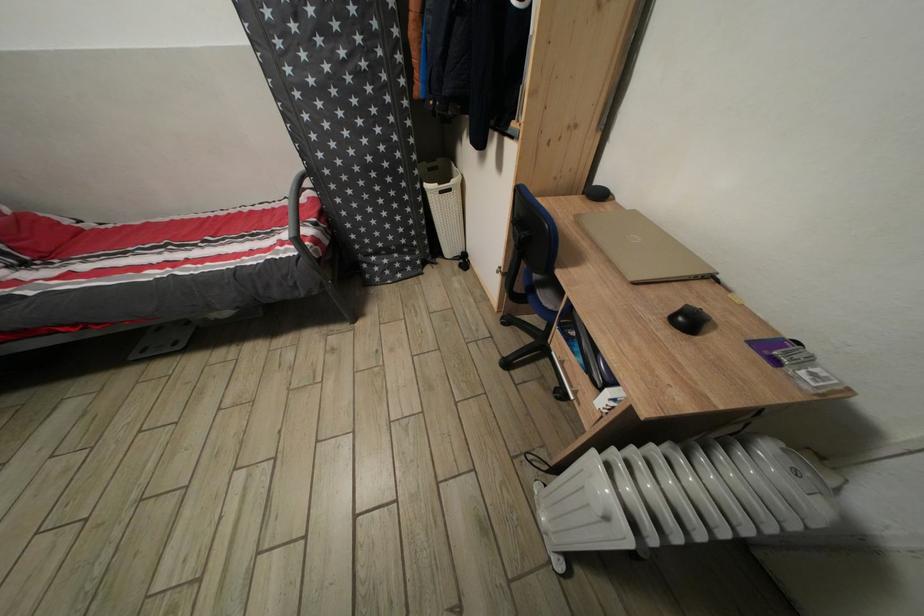
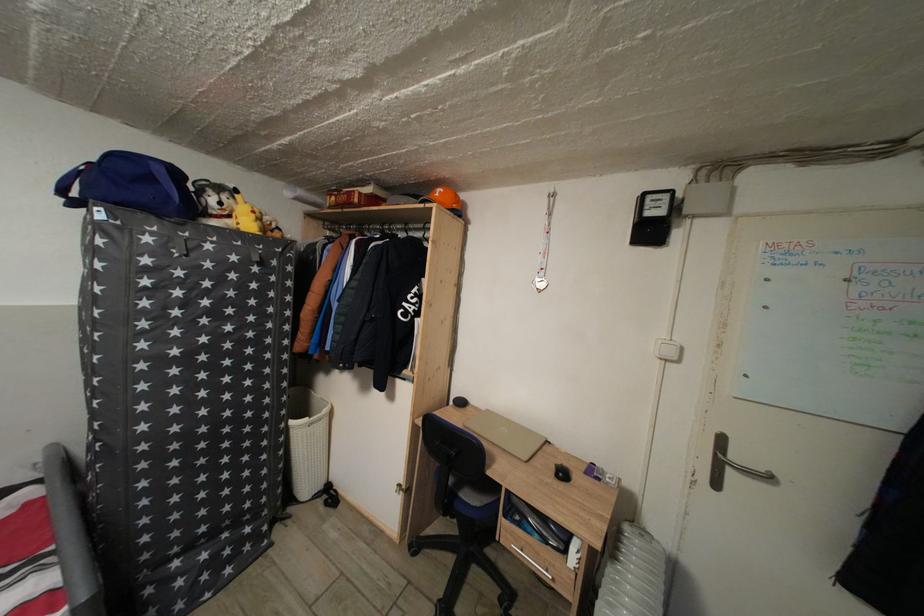
How did the camera likely rotate?

The rotation direction of the camera is right-up.